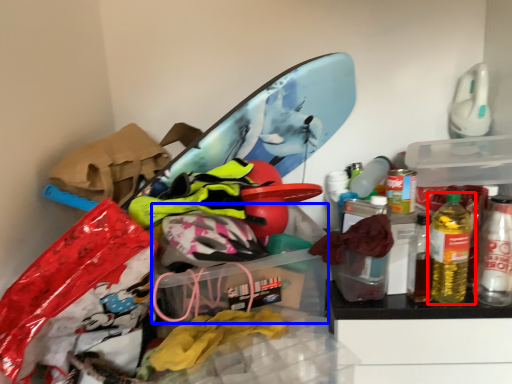
Question: Among these objects, which one is farthest to the camera, bottle (highlighted by a red box) or storage box (highlighted by a blue box)?

Choices:
 (A) bottle
 (B) storage box

Answer: (A)